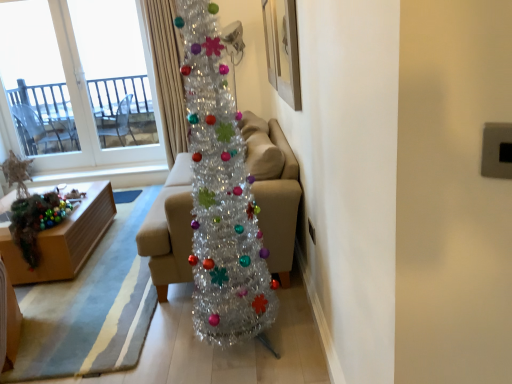
This screenshot has height=384, width=512. What do you see at coordinates (78, 85) in the screenshot?
I see `transparent glass window at upper left` at bounding box center [78, 85].

What do you see at coordinates (282, 49) in the screenshot? This screenshot has height=384, width=512. I see `wooden picture frame at upper center` at bounding box center [282, 49].

Identify the location of shiny metallic christmas tree at center. The image size is (512, 384). (221, 194).

I want to click on wooden box at lower left, so click(x=64, y=238).

Is the depth of beige fabric couch at center greater than that of transparent glass window at upper left?

No, it is in front of transparent glass window at upper left.

Considering the relative positions of beige fabric couch at center and transparent glass window at upper left in the image provided, is beige fabric couch at center to the right of transparent glass window at upper left from the viewer's perspective?

Yes.

Who is shorter, beige fabric couch at center or transparent glass window at upper left?

beige fabric couch at center is shorter.

Is point (170, 122) behind point (93, 239)?

Yes, point (170, 122) is behind point (93, 239).

Are silky beige curtain at upper center and wooden box at lower left far apart?

silky beige curtain at upper center is positioned a significant distance from wooden box at lower left.

Is silky beige curtain at upper center turned away from wooden box at lower left?

No, wooden box at lower left is not at the back of silky beige curtain at upper center.

Are shiny metallic christmas tree at center and wooden picture frame at upper center making contact?

shiny metallic christmas tree at center and wooden picture frame at upper center are not in contact.

Considering the relative positions of shiny metallic christmas tree at center and wooden picture frame at upper center in the image provided, is shiny metallic christmas tree at center in front of wooden picture frame at upper center?

Yes, it is.

Considering the positions of objects shiny metallic christmas tree at center and wooden picture frame at upper center in the image provided, who is more to the left, shiny metallic christmas tree at center or wooden picture frame at upper center?

shiny metallic christmas tree at center is more to the left.

Does shiny metallic christmas tree at center have a smaller size compared to wooden picture frame at upper center?

No, shiny metallic christmas tree at center is not smaller than wooden picture frame at upper center.

Is wooden box at lower left at the left side of transparent glass window at upper left?

In fact, wooden box at lower left is to the right of transparent glass window at upper left.

From the image's perspective, which object appears higher, wooden box at lower left or transparent glass window at upper left?

transparent glass window at upper left is shown above in the image.

Is wooden box at lower left surrounding transparent glass window at upper left?

That's incorrect, transparent glass window at upper left is not inside wooden box at lower left.

Which object is wider, wooden box at lower left or transparent glass window at upper left?

With larger width is wooden box at lower left.

Is wooden picture frame at upper center facing towards beige fabric couch at center?

No, wooden picture frame at upper center is not turned towards beige fabric couch at center.

Looking at this image, do you think wooden picture frame at upper center is within beige fabric couch at center, or outside of it?

wooden picture frame at upper center exists outside the volume of beige fabric couch at center.

Identify the location of picture frame lying on the right of beige fabric couch at center. The height and width of the screenshot is (384, 512). (282, 49).

Does point (294, 104) come behind point (162, 251)?

No.

Considering the sizes of objects wooden picture frame at upper center and transparent glass window at upper left in the image provided, who is wider, wooden picture frame at upper center or transparent glass window at upper left?

transparent glass window at upper left.

Is wooden picture frame at upper center aimed at transparent glass window at upper left?

No, wooden picture frame at upper center is not oriented towards transparent glass window at upper left.

Does wooden picture frame at upper center have a lesser height compared to transparent glass window at upper left?

Yes.

Is the position of wooden picture frame at upper center less distant than that of transparent glass window at upper left?

Yes, it is in front of transparent glass window at upper left.

Could you tell me if beige fabric couch at center is facing shiny metallic christmas tree at center?

No, beige fabric couch at center is not aimed at shiny metallic christmas tree at center.

Is beige fabric couch at center taller or shorter than shiny metallic christmas tree at center?

In the image, beige fabric couch at center appears to be shorter than shiny metallic christmas tree at center.

Would you consider beige fabric couch at center to be distant from shiny metallic christmas tree at center?

They are positioned close to each other.

I want to click on studio couch on the right of transparent glass window at upper left, so click(x=273, y=189).

Locate an element on the screen. The height and width of the screenshot is (384, 512). table on the left side of silky beige curtain at upper center is located at coordinates (64, 238).

Based on their spatial positions, is silky beige curtain at upper center or wooden box at lower left further from beige fabric couch at center?

silky beige curtain at upper center is further to beige fabric couch at center.

When comparing their distances from wooden box at lower left, does beige fabric couch at center or transparent glass window at upper left seem further?

transparent glass window at upper left is positioned further to the anchor wooden box at lower left.

From the picture: Based on their spatial positions, is transparent glass window at upper left or wooden picture frame at upper center further from silky beige curtain at upper center?

wooden picture frame at upper center is positioned further to the anchor silky beige curtain at upper center.

Considering their positions, is wooden box at lower left positioned closer to shiny metallic christmas tree at center than silky beige curtain at upper center?

wooden box at lower left is closer to shiny metallic christmas tree at center.

Looking at this image, looking at the image, which one is located further to wooden box at lower left, shiny metallic christmas tree at center or wooden picture frame at upper center?

Among the two, wooden picture frame at upper center is located further to wooden box at lower left.

From the picture: Estimate the real-world distances between objects in this image. Which object is closer to beige fabric couch at center, shiny metallic christmas tree at center or silky beige curtain at upper center?

Among the two, shiny metallic christmas tree at center is located nearer to beige fabric couch at center.

Looking at the image, which one is located further to beige fabric couch at center, silky beige curtain at upper center or wooden picture frame at upper center?

Among the two, silky beige curtain at upper center is located further to beige fabric couch at center.

From the image, which object appears to be nearer to transparent glass window at upper left, wooden box at lower left or beige fabric couch at center?

wooden box at lower left lies closer to transparent glass window at upper left than the other object.

You are a GUI agent. You are given a task and a screenshot of the screen. Output one action in this format:
    pyautogui.click(x=<x>, y=<y>)
    Task: Click on the studio couch between shiny metallic christmas tree at center and transparent glass window at upper left in the front-back direction
    This screenshot has height=384, width=512.
    Given the screenshot: What is the action you would take?
    pyautogui.click(x=273, y=189)

This screenshot has width=512, height=384. I want to click on curtain positioned between wooden picture frame at upper center and transparent glass window at upper left from near to far, so click(167, 74).

At what (x,y) coordinates should I click in order to perform the action: click on table positioned between shiny metallic christmas tree at center and silky beige curtain at upper center from near to far. Please return your answer as a coordinate pair (x, y). This screenshot has height=384, width=512. Looking at the image, I should click on (64, 238).

You are a GUI agent. You are given a task and a screenshot of the screen. Output one action in this format:
    pyautogui.click(x=<x>, y=<y>)
    Task: Click on the studio couch that lies between wooden picture frame at upper center and shiny metallic christmas tree at center from top to bottom
    This screenshot has height=384, width=512.
    Given the screenshot: What is the action you would take?
    pyautogui.click(x=273, y=189)